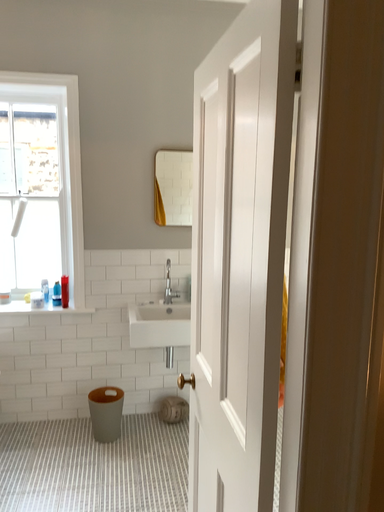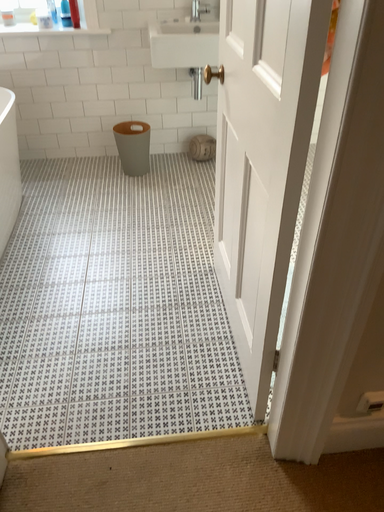
Question: Which way did the camera rotate in the video?

Choices:
 (A) rotated upward
 (B) rotated downward

Answer: (B)